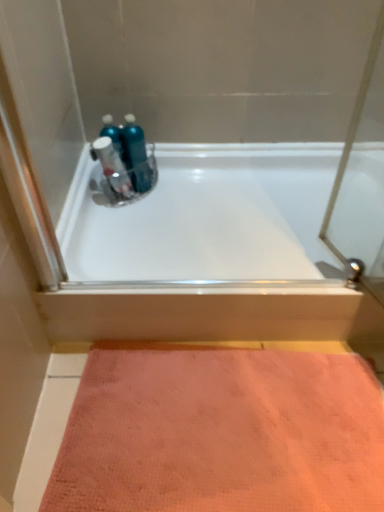
Looking at this image, what is the approximate width of white glossy bathtub at upper center?

It is 25.07 inches.

Identify the location of metallic blue spray bottle at upper center. (112, 166).

Which is less distant, (x=157, y=359) or (x=111, y=167)?

Point (x=157, y=359) is positioned closer to the camera compared to point (x=111, y=167).

Could you tell me if pink textured mat at lower center is turned towards metallic blue spray bottle at upper center?

No, pink textured mat at lower center is not facing towards metallic blue spray bottle at upper center.

Is pink textured mat at lower center directly adjacent to metallic blue spray bottle at upper center?

No, pink textured mat at lower center is not in contact with metallic blue spray bottle at upper center.

From a real-world perspective, which object stands above the other?

In real-world perspective, metallic blue spray bottle at upper center is above.

From a real-world perspective, is blue glossy mouthwash at center on pink textured mat at lower center?

Indeed, from a real-world perspective, blue glossy mouthwash at center stands above pink textured mat at lower center.

From the image's perspective, would you say blue glossy mouthwash at center is positioned over pink textured mat at lower center?

Yes, from the image's perspective, blue glossy mouthwash at center is above pink textured mat at lower center.

Between blue glossy mouthwash at center and pink textured mat at lower center, which one has more height?

blue glossy mouthwash at center is taller.

Looking at this image, considering the relative sizes of blue glossy mouthwash at center and pink textured mat at lower center in the image provided, is blue glossy mouthwash at center bigger than pink textured mat at lower center?

No, blue glossy mouthwash at center is not bigger than pink textured mat at lower center.

In the scene shown: Is white glossy bathtub at upper center surrounded by metallic blue spray bottle at upper center?

No, white glossy bathtub at upper center is not surrounded by metallic blue spray bottle at upper center.

Considering their positions, is metallic blue spray bottle at upper center located in front of or behind white glossy bathtub at upper center?

Clearly, metallic blue spray bottle at upper center is behind white glossy bathtub at upper center.

Which is more to the left, metallic blue spray bottle at upper center or white glossy bathtub at upper center?

Positioned to the left is metallic blue spray bottle at upper center.

Is metallic blue spray bottle at upper center facing towards white glossy bathtub at upper center?

No, metallic blue spray bottle at upper center is not oriented towards white glossy bathtub at upper center.

Between white glossy bathtub at upper center and metallic blue spray bottle at upper center, which one has more height?

Standing taller between the two is metallic blue spray bottle at upper center.

From the image's perspective, is white glossy bathtub at upper center located beneath metallic blue spray bottle at upper center?

Yes, from the image's perspective, white glossy bathtub at upper center is beneath metallic blue spray bottle at upper center.

Is white glossy bathtub at upper center inside or outside of metallic blue spray bottle at upper center?

white glossy bathtub at upper center is not inside metallic blue spray bottle at upper center, it's outside.

Locate an element on the screen. The image size is (384, 512). cleaning product on the left side of white glossy bathtub at upper center is located at coordinates (112, 166).

Is pink textured mat at lower center to the right of blue glossy mouthwash at center from the viewer's perspective?

Correct, you'll find pink textured mat at lower center to the right of blue glossy mouthwash at center.

Is pink textured mat at lower center smaller than blue glossy mouthwash at center?

No.

From the image's perspective, which is above, pink textured mat at lower center or blue glossy mouthwash at center?

blue glossy mouthwash at center, from the image's perspective.

Does pink textured mat at lower center have a greater width compared to blue glossy mouthwash at center?

Yes.

Is pink textured mat at lower center spatially inside white glossy bathtub at upper center, or outside of it?

pink textured mat at lower center lies outside white glossy bathtub at upper center.

Considering their positions, is pink textured mat at lower center located in front of or behind white glossy bathtub at upper center?

Visually, pink textured mat at lower center is located in front of white glossy bathtub at upper center.

Is pink textured mat at lower center to the right of white glossy bathtub at upper center from the viewer's perspective?

No, pink textured mat at lower center is not to the right of white glossy bathtub at upper center.

From the image's perspective, is metallic blue spray bottle at upper center below blue glossy mouthwash at center?

Correct, metallic blue spray bottle at upper center appears lower than blue glossy mouthwash at center in the image.

Consider the image. Which of these two, metallic blue spray bottle at upper center or blue glossy mouthwash at center, is thinner?

metallic blue spray bottle at upper center.

Considering the positions of points (111, 166) and (130, 147), is point (111, 166) closer to camera compared to point (130, 147)?

Yes, it is in front of point (130, 147).

The width and height of the screenshot is (384, 512). In order to click on doormat on the right side of metallic blue spray bottle at upper center in this screenshot , I will do `click(220, 432)`.

Locate an element on the screen. This screenshot has height=512, width=384. doormat that is below the blue glossy mouthwash at center (from the image's perspective) is located at coordinates (220, 432).

Which object lies nearer to the anchor point metallic blue spray bottle at upper center, blue glossy mouthwash at center or white glossy bathtub at upper center?

blue glossy mouthwash at center is positioned closer to the anchor metallic blue spray bottle at upper center.

When comparing their distances from blue glossy mouthwash at center, does white glossy bathtub at upper center or metallic blue spray bottle at upper center seem further?

The object further to blue glossy mouthwash at center is white glossy bathtub at upper center.

Estimate the real-world distances between objects in this image. Which object is further from blue glossy mouthwash at center, metallic blue spray bottle at upper center or pink textured mat at lower center?

Based on the image, pink textured mat at lower center appears to be further to blue glossy mouthwash at center.

Considering their positions, is blue glossy mouthwash at center positioned closer to pink textured mat at lower center than metallic blue spray bottle at upper center?

Among the two, metallic blue spray bottle at upper center is located nearer to pink textured mat at lower center.

Considering their positions, is blue glossy mouthwash at center positioned closer to white glossy bathtub at upper center than metallic blue spray bottle at upper center?

blue glossy mouthwash at center lies closer to white glossy bathtub at upper center than the other object.

Looking at the image, which one is located further to blue glossy mouthwash at center, white glossy bathtub at upper center or pink textured mat at lower center?

pink textured mat at lower center is further to blue glossy mouthwash at center.

From the image, which object appears to be farther from pink textured mat at lower center, metallic blue spray bottle at upper center or blue glossy mouthwash at center?

The object further to pink textured mat at lower center is blue glossy mouthwash at center.

Estimate the real-world distances between objects in this image. Which object is further from pink textured mat at lower center, white glossy bathtub at upper center or blue glossy mouthwash at center?

blue glossy mouthwash at center is further to pink textured mat at lower center.

Identify the location of mouthwash situated between metallic blue spray bottle at upper center and white glossy bathtub at upper center from left to right. 136,155.

I want to click on bathtub between metallic blue spray bottle at upper center and pink textured mat at lower center in the vertical direction, so click(206, 217).

This screenshot has width=384, height=512. In order to click on bathtub between blue glossy mouthwash at center and pink textured mat at lower center in the up-down direction in this screenshot , I will do `click(206, 217)`.

Image resolution: width=384 pixels, height=512 pixels. I want to click on cleaning product that lies between blue glossy mouthwash at center and pink textured mat at lower center from top to bottom, so click(112, 166).